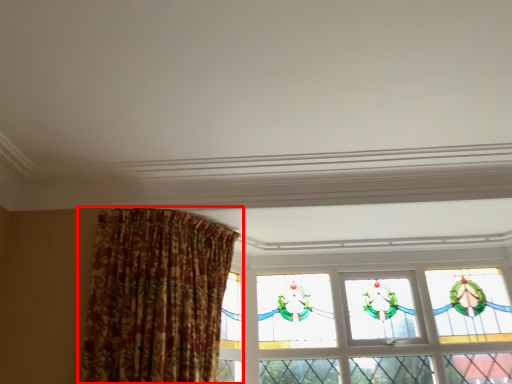
Question: Observing the image, what is the correct spatial positioning of curtain (annotated by the red box) in reference to window?

Choices:
 (A) left
 (B) right

Answer: (A)